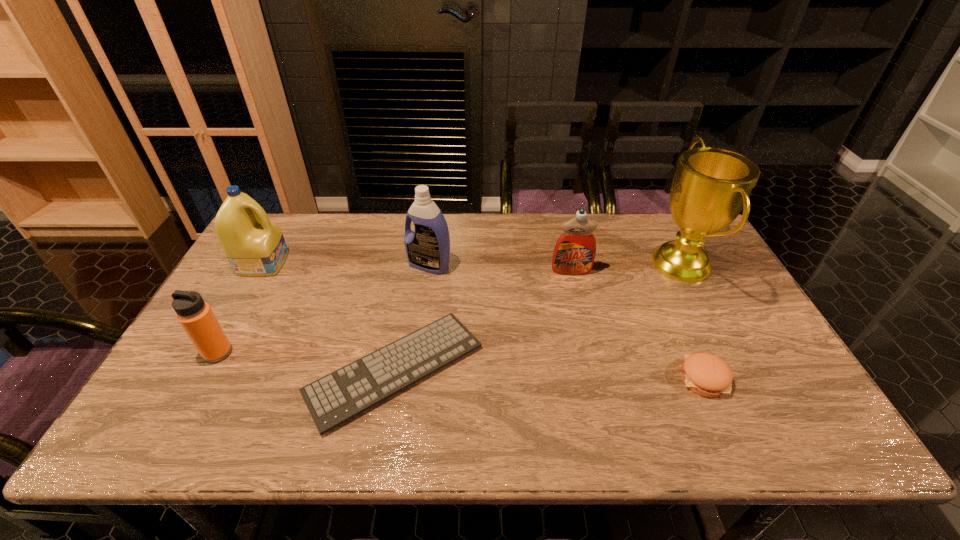
What are the coordinates of `vacant space positioned on the shiny surface of the tallest object` in the screenshot? It's located at (627, 265).

Where is `vacant position located on the back of the second detergent from right to left`? This screenshot has height=540, width=960. vacant position located on the back of the second detergent from right to left is located at coordinates (435, 221).

Locate an element on the screen. The image size is (960, 540). vacant point located on the label of the leftmost detergent is located at coordinates (368, 262).

Where is `vacant space located on the front surface of the third object from right to left`? vacant space located on the front surface of the third object from right to left is located at coordinates (595, 374).

Identify the location of vacant space located 0.080m on the right of the thermos bottle. The image size is (960, 540). (263, 353).

Locate an element on the screen. The image size is (960, 540). blank space located on the back of the second shortest object is located at coordinates (659, 277).

The image size is (960, 540). In order to click on vacant space situated on the left of the computer keyboard in this screenshot , I will do `click(244, 369)`.

You are a GUI agent. You are given a task and a screenshot of the screen. Output one action in this format:
    pyautogui.click(x=<x>, y=<y>)
    Task: Click on the award located in the far edge section of the desktop
    This screenshot has height=540, width=960.
    Given the screenshot: What is the action you would take?
    pyautogui.click(x=711, y=186)

In order to click on object that is at the near edge in this screenshot , I will do point(332,400).

Find the location of a particular element. The width and height of the screenshot is (960, 540). detergent located in the left edge section of the desktop is located at coordinates point(255,247).